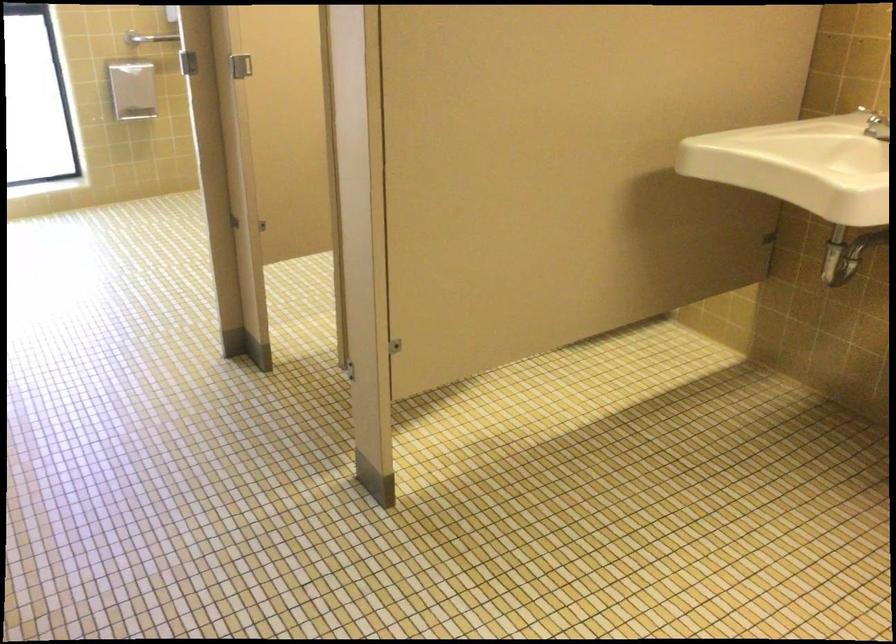
This screenshot has width=896, height=644. Identify the location of metal grab bar. (149, 38).